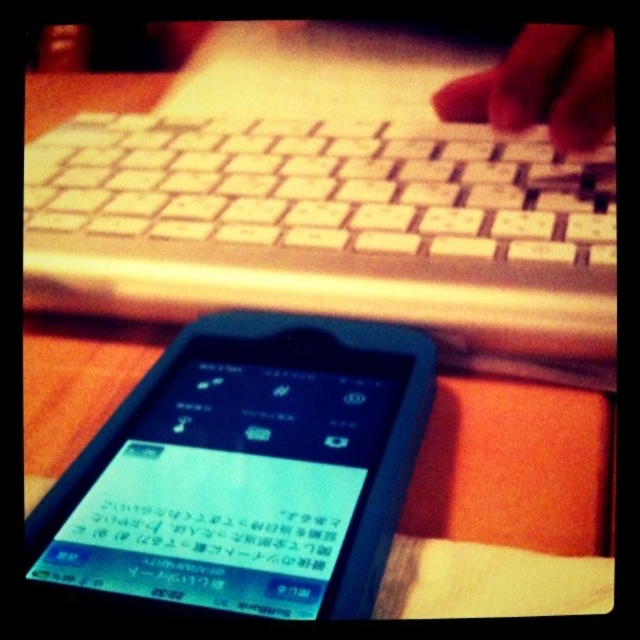
Question: Estimate the real-world distances between objects in this image. Which object is farther from the blue plastic phone at lower center?

Choices:
 (A) smooth skin hand at upper right
 (B) white plastic keyboard at upper center

Answer: (A)

Question: Can you confirm if black matte smartphone at lower center is positioned above blue plastic phone at lower center?

Choices:
 (A) yes
 (B) no

Answer: (A)

Question: Does black matte smartphone at lower center have a greater width compared to blue plastic phone at lower center?

Choices:
 (A) yes
 (B) no

Answer: (A)

Question: Is blue plastic phone at lower center closer to camera compared to smooth skin hand at upper right?

Choices:
 (A) no
 (B) yes

Answer: (B)

Question: Which object is farther from the camera taking this photo?

Choices:
 (A) blue plastic phone at lower center
 (B) smooth skin hand at upper right
 (C) black matte smartphone at lower center
 (D) white plastic keyboard at upper center

Answer: (B)

Question: Which point is farther to the camera?

Choices:
 (A) (250, 529)
 (B) (372, 593)
 (C) (529, 122)
 (D) (106, 148)

Answer: (D)